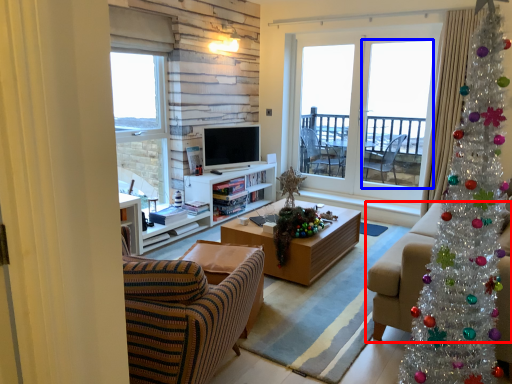
Question: Which of the following is the closest to the observer, studio couch (highlighted by a red box) or screen door (highlighted by a blue box)?

Choices:
 (A) studio couch
 (B) screen door

Answer: (A)